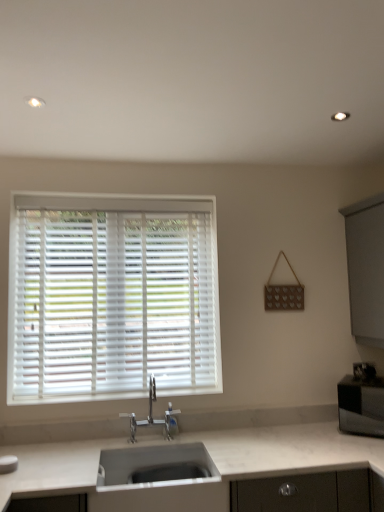
Find the location of a particular element. blank space situated above white plastic blinds at upper left (from a real-world perspective) is located at coordinates (128, 199).